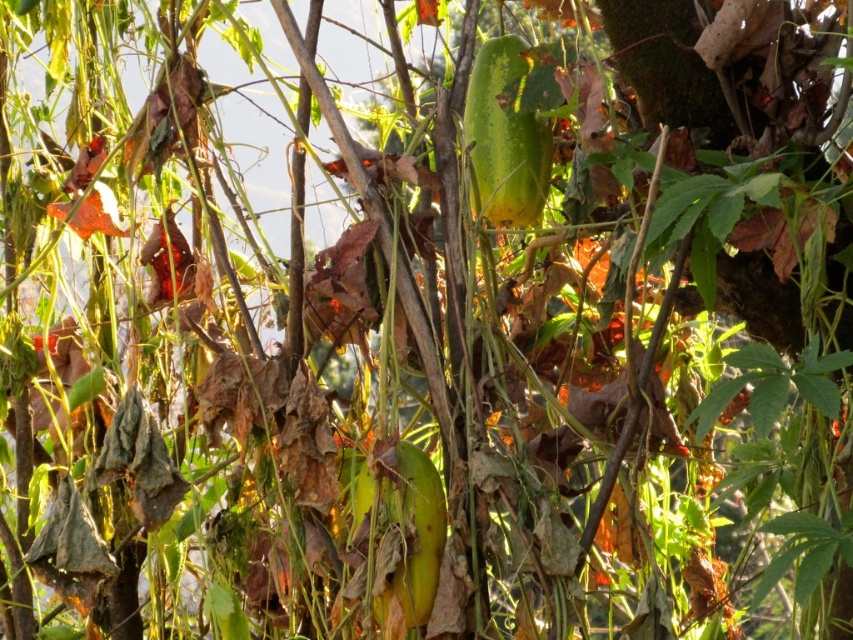
Is green matte papaya at center wider than green matte pickle at center?

In fact, green matte papaya at center might be narrower than green matte pickle at center.

Is green matte papaya at center to the left of green matte pickle at center from the viewer's perspective?

Incorrect, green matte papaya at center is not on the left side of green matte pickle at center.

Is point (477, 58) more distant than point (422, 618)?

Yes, point (477, 58) is farther from viewer.

The height and width of the screenshot is (640, 853). Identify the location of green matte papaya at center. (505, 140).